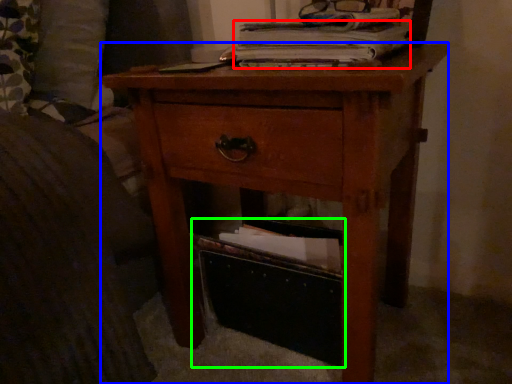
Question: Considering the real-world distances, which object is closest to paperback book (highlighted by a red box)? nightstand (highlighted by a blue box) or storage box (highlighted by a green box).

Choices:
 (A) nightstand
 (B) storage box

Answer: (A)